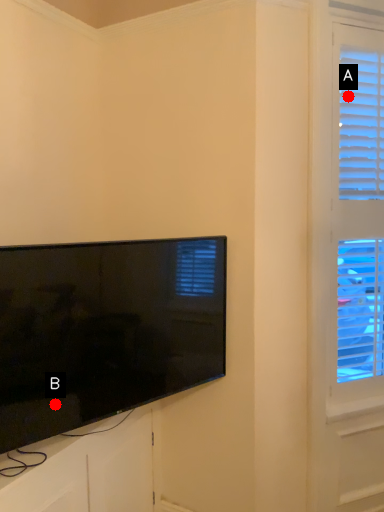
Question: Two points are circled on the image, labeled by A and B beside each circle. Which point is further to the camera?

Choices:
 (A) A is further
 (B) B is further

Answer: (A)